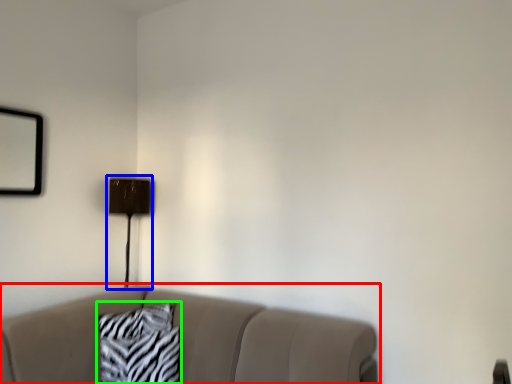
Question: Which object is positioned closest to studio couch (highlighted by a red box)? Select from table lamp (highlighted by a blue box) and pillow (highlighted by a green box).

Choices:
 (A) table lamp
 (B) pillow

Answer: (B)